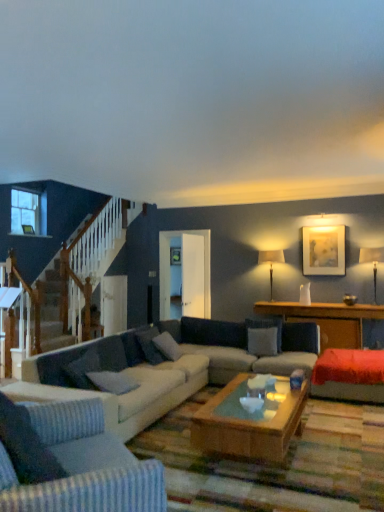
Question: Should I look upward or downward to see gray fabric pillow at center, the first pillow from the back?

Choices:
 (A) up
 (B) down

Answer: (B)

Question: From a real-world perspective, is gray fabric pillow at center, which is counted as the 1th pillow, starting from the right, located beneath gray fabric pillow at center, which is the 3th pillow in right-to-left order?

Choices:
 (A) no
 (B) yes

Answer: (B)

Question: Does gray fabric pillow at center, the first pillow from the back, come behind gray fabric pillow at center, the 2th pillow in the left-to-right sequence?

Choices:
 (A) no
 (B) yes

Answer: (B)

Question: Is gray fabric pillow at center, the fourth pillow when ordered from front to back, in front of gray fabric pillow at center, which is counted as the second pillow, starting from the front?

Choices:
 (A) no
 (B) yes

Answer: (A)

Question: Is gray fabric pillow at center, which is counted as the 1th pillow, starting from the right, aimed at gray fabric pillow at center, which is the 3th pillow in right-to-left order?

Choices:
 (A) no
 (B) yes

Answer: (A)

Question: Is gray fabric pillow at center, the fourth pillow when ordered from front to back, to the right of gray fabric pillow at center, the third pillow viewed from the back, from the viewer's perspective?

Choices:
 (A) yes
 (B) no

Answer: (A)

Question: Is gray fabric pillow at center, the first pillow from the back, bigger than gray fabric pillow at center, the 2th pillow in the left-to-right sequence?

Choices:
 (A) no
 (B) yes

Answer: (A)

Question: Does light gray fabric couch at lower left, the 2th studio couch when ordered from back to front, have a lesser width compared to gray fabric pillow at center, which is counted as the fourth pillow, starting from the back?

Choices:
 (A) no
 (B) yes

Answer: (A)

Question: Is light gray fabric couch at lower left, acting as the 1th studio couch starting from the front, not inside gray fabric pillow at center, which appears as the 1th pillow when viewed from the front?

Choices:
 (A) no
 (B) yes

Answer: (B)

Question: Does light gray fabric couch at lower left, the 2th studio couch when ordered from back to front, have a larger size compared to gray fabric pillow at center, the 1th pillow positioned from the left?

Choices:
 (A) no
 (B) yes

Answer: (B)

Question: Is light gray fabric couch at lower left, the 2th studio couch when ordered from back to front, at the left side of gray fabric pillow at center, the 4th pillow when ordered from right to left?

Choices:
 (A) yes
 (B) no

Answer: (B)

Question: From a real-world perspective, does light gray fabric couch at lower left, acting as the 1th studio couch starting from the front, sit lower than gray fabric pillow at center, the 1th pillow positioned from the left?

Choices:
 (A) yes
 (B) no

Answer: (A)

Question: Does light gray fabric couch at lower left, acting as the 1th studio couch starting from the front, have a greater width compared to gray fabric pillow at center, which appears as the 1th pillow when viewed from the front?

Choices:
 (A) yes
 (B) no

Answer: (A)

Question: Can you confirm if velvet red couch at right is bigger than gray fabric pillow at center, the 1th pillow positioned from the left?

Choices:
 (A) yes
 (B) no

Answer: (A)